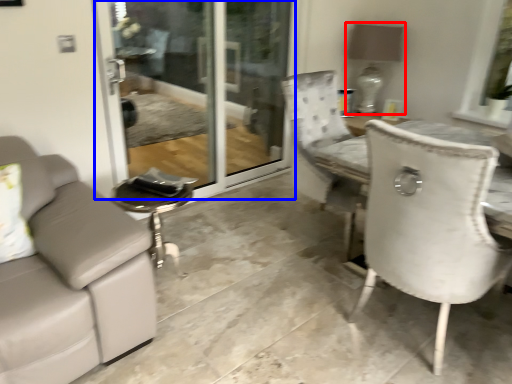
Question: Among these objects, which one is nearest to the camera, lamp (highlighted by a red box) or screen door (highlighted by a blue box)?

Choices:
 (A) lamp
 (B) screen door

Answer: (B)